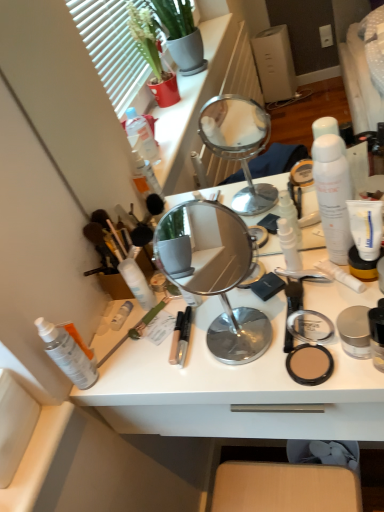
At what (x,y) coordinates should I click in order to perform the action: click on vacant area that lies to the right of white matte spray can at center, which is the fourth toiletry in left-to-right order. Please return your answer as a coordinate pair (x, y). The width and height of the screenshot is (384, 512). Looking at the image, I should click on click(x=226, y=300).